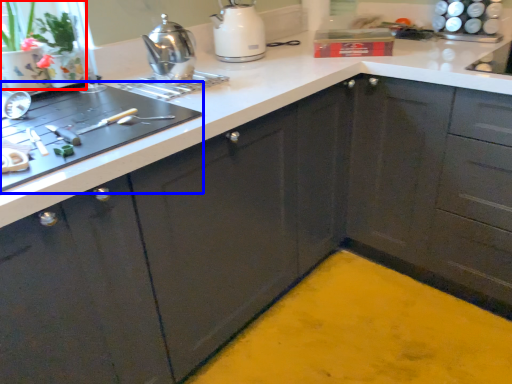
Question: Which of the following is the farthest to the observer, plant (highlighted by a red box) or home appliance (highlighted by a blue box)?

Choices:
 (A) plant
 (B) home appliance

Answer: (A)